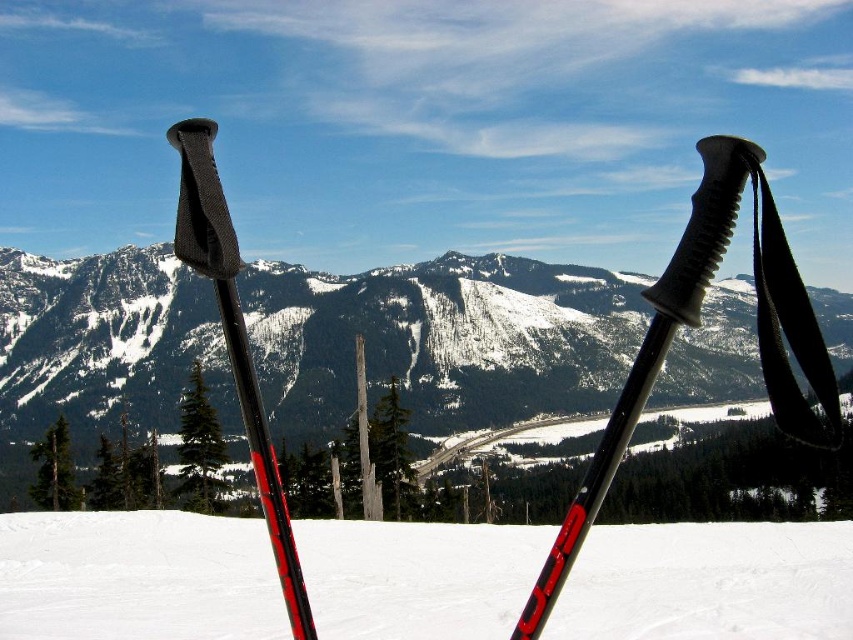
In the scene shown: You are a photographer standing at the edge of a snowy field, and you want to capture a photo of the black rubber ski pole at center. If your camera has a focal length of 50mm and the ski pole is 404.97 feet away, what is the approximate angle of view required to frame the ski pole properly?

To determine the angle of view needed, you can use the formula for angle of view calculation. The black rubber ski pole at center is 404.97 feet away. However, without knowing the size of the ski pole, it is impossible to calculate the exact angle of view required. Please provide the height or width of the ski pole to proceed with the calculation.

You are standing in the winter landscape and want to take a photo of the snowy granite mountain at center and the black rubber ski pole at center. Which object should you frame first in your camera to ensure both are in the shot?

You should frame the snowy granite mountain at center first because it is to the left of the black rubber ski pole at center, so positioning the mountain first will allow the ski pole to be included in the frame as well.